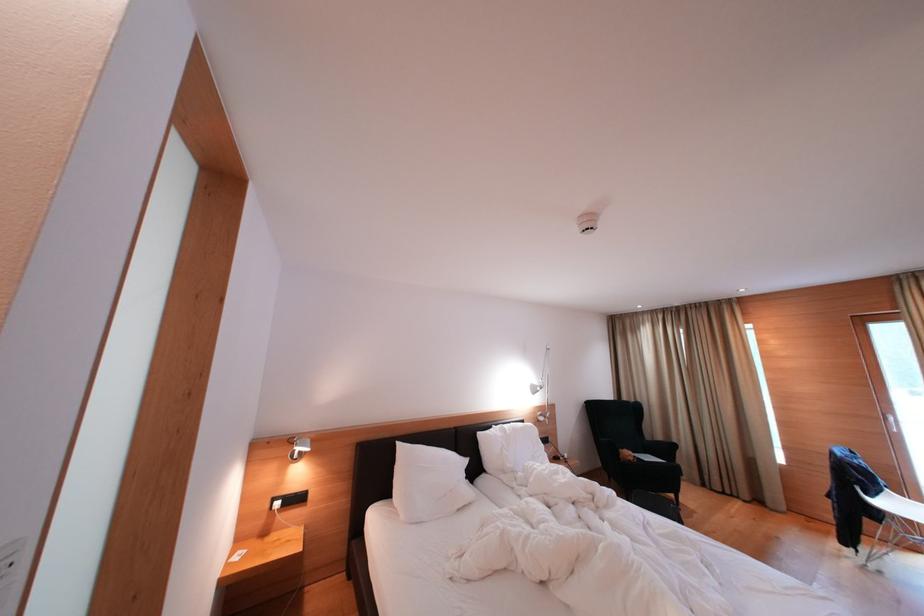
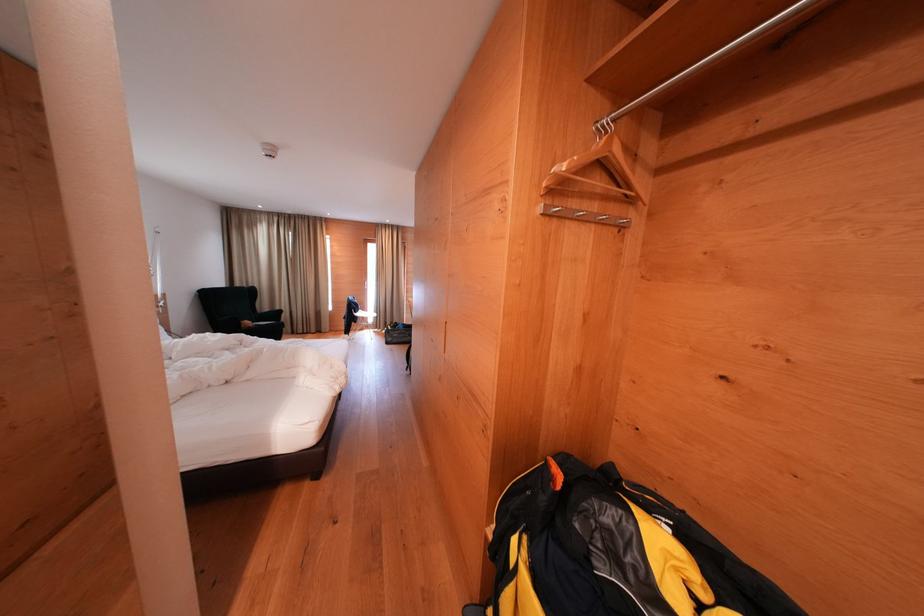
The point at [625,456] is marked in the first image. Where is the corresponding point in the second image?

(247, 329)